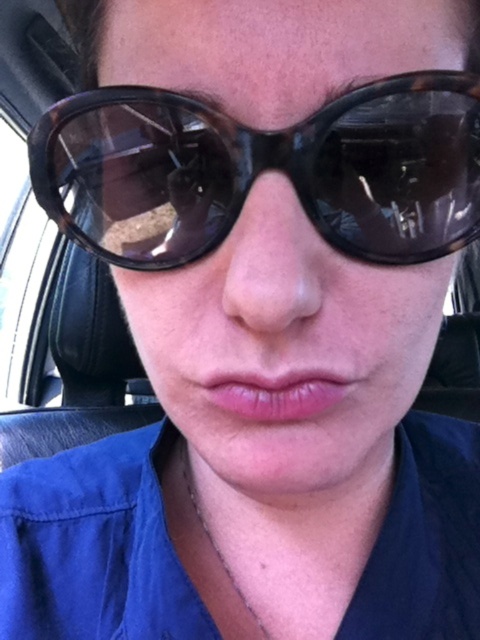
Question: Does tortoiseshell sunglasses at center appear on the left side of pink glossy lips at center?

Choices:
 (A) no
 (B) yes

Answer: (B)

Question: Does tortoiseshell sunglasses at center have a lesser width compared to pink glossy lips at center?

Choices:
 (A) yes
 (B) no

Answer: (B)

Question: Is tortoiseshell sunglasses at center below pink glossy lips at center?

Choices:
 (A) no
 (B) yes

Answer: (A)

Question: Which of the following is the farthest from the observer?

Choices:
 (A) tortoiseshell sunglasses at center
 (B) pink glossy lips at center

Answer: (B)